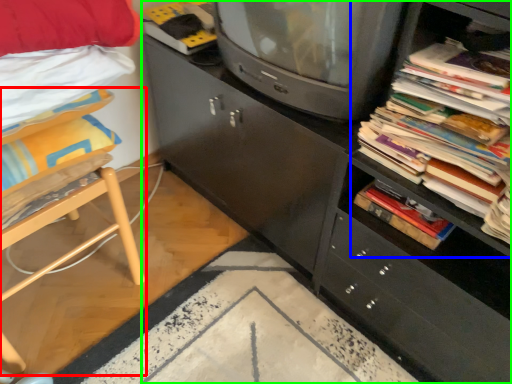
Question: Which is nearer to the furniture (highlighted by a red box)? shelf (highlighted by a blue box) or cabinetry (highlighted by a green box).

Choices:
 (A) shelf
 (B) cabinetry

Answer: (B)